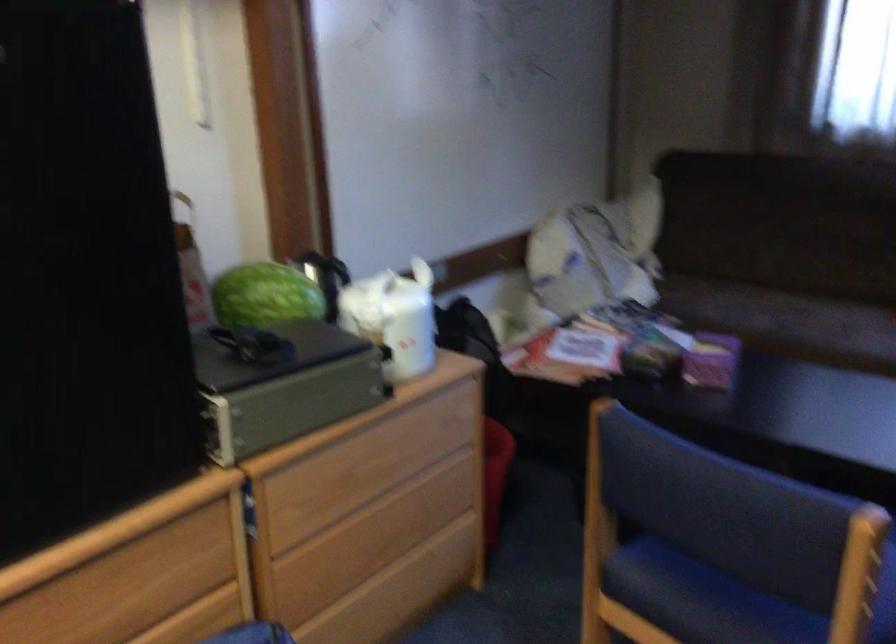
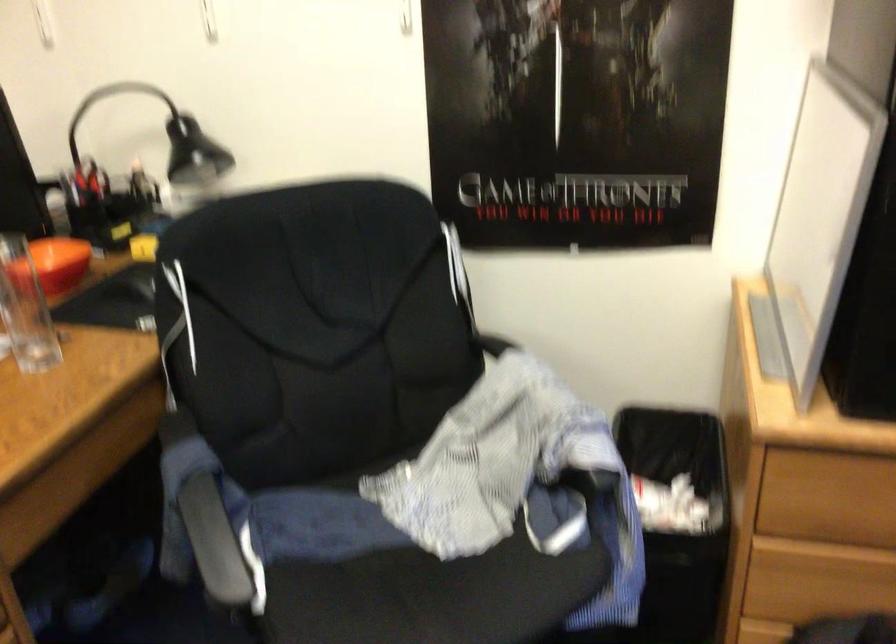
First-person continuous shooting, in which direction is the camera rotating?

The camera rotated toward left-down.